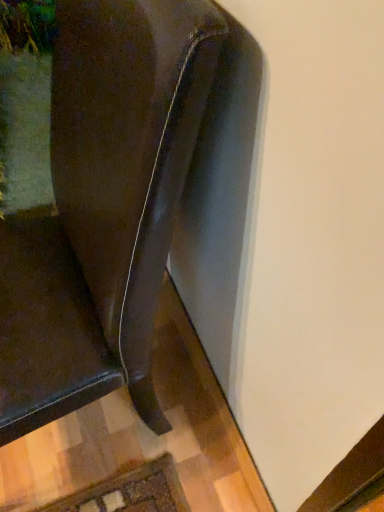
Where is `matte black chair at lower left`? matte black chair at lower left is located at coordinates (119, 197).

What do you see at coordinates (119, 197) in the screenshot?
I see `matte black chair at lower left` at bounding box center [119, 197].

In order to click on matte black chair at lower left in this screenshot , I will do `click(119, 197)`.